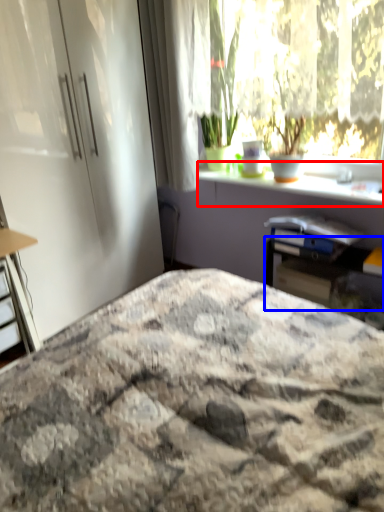
Question: Among these objects, which one is farthest to the camera, window sill (highlighted by a red box) or table (highlighted by a blue box)?

Choices:
 (A) window sill
 (B) table

Answer: (B)